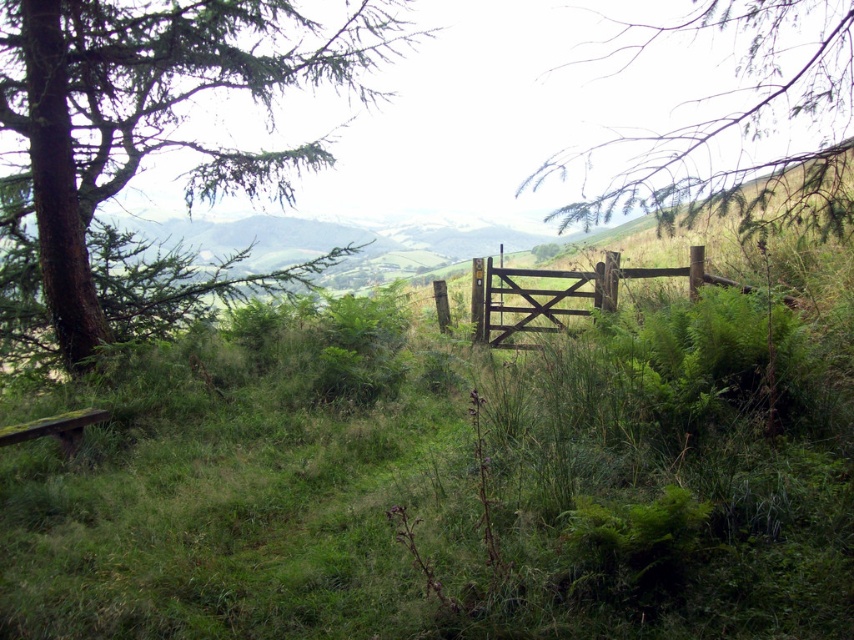
You are a hiker who wants to take a photo of the brown wooden gate at center. However, you notice the green leafy tree at upper left might block the view. Based on the scene description, will the tree obstruct the gate in your photo?

The green leafy tree at upper left is positioned over brown wooden gate at center, so it will obstruct the view of the gate in your photo.

You are a hiker standing in front of the brown wooden gate at center. You notice a green leafy tree at upper left in the distance. Which object is closer to you?

The green leafy tree at upper left is closer to the viewer than the brown wooden gate at center, so the tree is closer.